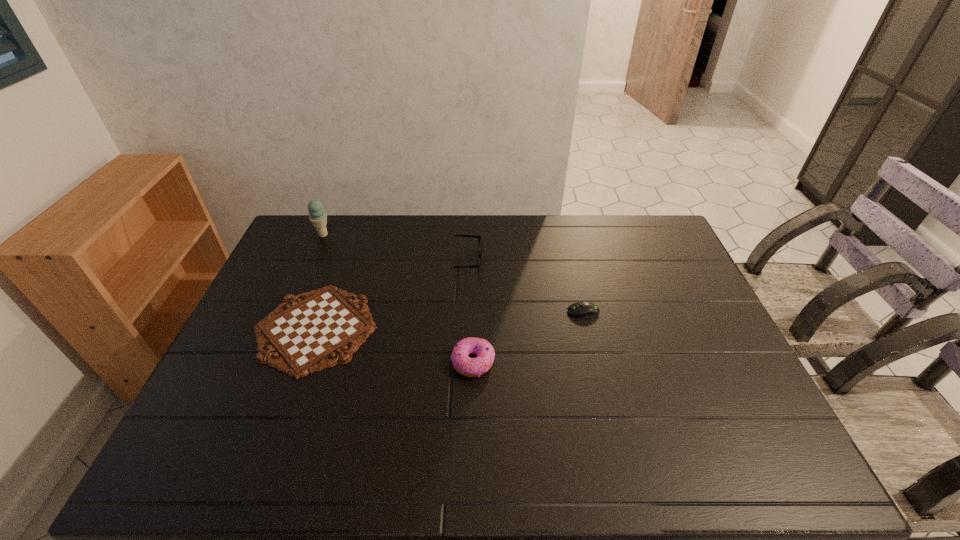
This screenshot has height=540, width=960. In the image, there is a desktop. Find the location of `vacant space at the far edge`. vacant space at the far edge is located at coordinates (509, 218).

In the image, there is a desktop. At what (x,y) coordinates should I click in order to perform the action: click on free space at the near edge. Please return your answer as a coordinate pair (x, y). The image size is (960, 540). Looking at the image, I should click on (420, 446).

In the image, there is a desktop. At what (x,y) coordinates should I click in order to perform the action: click on vacant space at the right edge. Please return your answer as a coordinate pair (x, y). This screenshot has height=540, width=960. Looking at the image, I should click on (679, 319).

The height and width of the screenshot is (540, 960). What are the coordinates of `vacant space at the near left corner` in the screenshot? It's located at (216, 444).

This screenshot has height=540, width=960. I want to click on free region at the far right corner, so click(647, 222).

This screenshot has width=960, height=540. I want to click on free space between the fourth tallest object and the shortest object, so click(x=449, y=320).

Where is `free space between the computer mouse and the doughnut`? The image size is (960, 540). free space between the computer mouse and the doughnut is located at coordinates (528, 336).

You are a GUI agent. You are given a task and a screenshot of the screen. Output one action in this format:
    pyautogui.click(x=<x>, y=<y>)
    Task: Click on the unoccupied area between the spectacles and the shortest object
    The image size is (960, 540).
    Given the screenshot: What is the action you would take?
    pyautogui.click(x=393, y=295)

Locate an element on the screen. vacant space that's between the fourth nearest object and the third shortest object is located at coordinates (471, 312).

The width and height of the screenshot is (960, 540). I want to click on empty space that is in between the fourth tallest object and the doughnut, so click(528, 336).